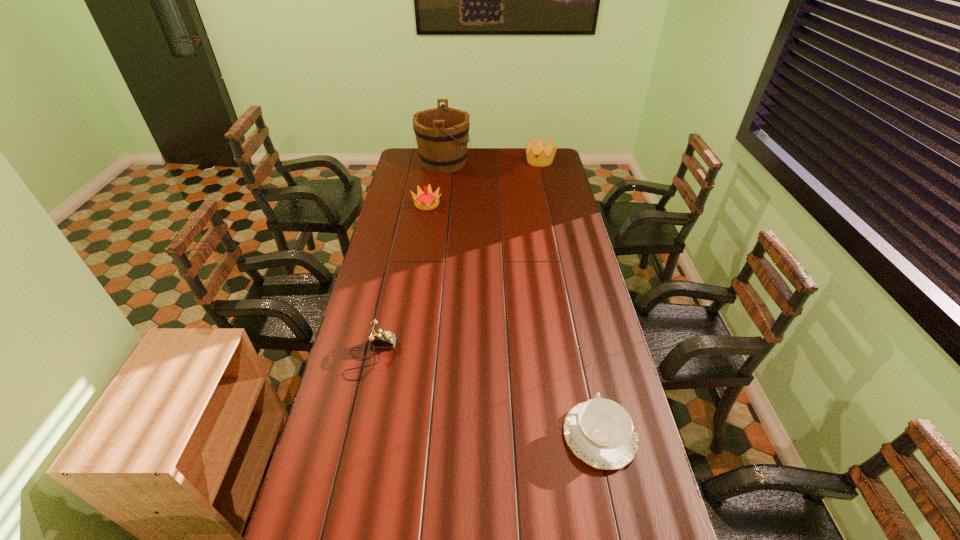
This screenshot has width=960, height=540. Find the location of `the tallest object`. the tallest object is located at coordinates (441, 133).

Find the location of a particular element. The height and width of the screenshot is (540, 960). the right crown is located at coordinates (546, 153).

Locate an element on the screen. the third nearest object is located at coordinates (427, 200).

Identify the location of the nearer crown. (427, 200).

Find the location of `telephone`. telephone is located at coordinates (379, 338).

Where is `chinaware`? The width and height of the screenshot is (960, 540). chinaware is located at coordinates (599, 432).

Where is `free space located on the side of the wine bucket with the handle for carrying`? free space located on the side of the wine bucket with the handle for carrying is located at coordinates (483, 162).

Locate an element on the screen. vacant space situated 0.250m on the front of the farther crown is located at coordinates 546,193.

Locate an element on the screen. free spot located 0.300m on the back of the third nearest object is located at coordinates (433, 167).

Image resolution: width=960 pixels, height=540 pixels. I want to click on vacant region located on the dial of the telephone, so click(x=439, y=356).